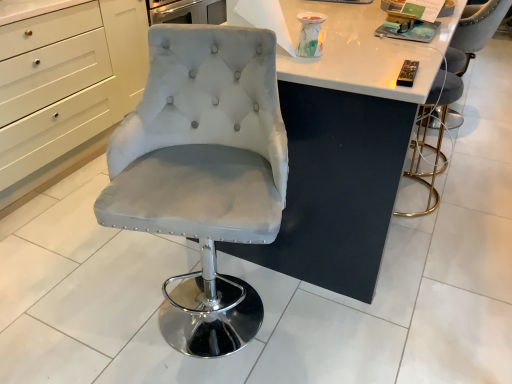
Identify the location of white matte cabinet at left. The height and width of the screenshot is (384, 512). (67, 89).

Describe the element at coordinates (409, 31) in the screenshot. I see `matte gray magazine at upper right, positioned as the 2th magazine in bottom-to-top order` at that location.

Find the location of a particular element. satin white chair at center, which is counted as the 1th chair, starting from the left is located at coordinates (203, 171).

What are the coordinates of `black plastic remote control at upper right, arranged as the second magazine when viewed from the top` in the screenshot? It's located at (407, 73).

At what (x,y) coordinates should I click in order to perform the action: click on metallic gold bar stool at right, the 2th chair from the front. Please return your answer as a coordinate pair (x, y). Looking at the image, I should click on (426, 135).

Is satin white chair at center, arranged as the 3th chair when viewed from the right, at the back of matte gray magazine at upper right, marked as the second magazine in a front-to-back arrangement?

No, matte gray magazine at upper right, marked as the second magazine in a front-to-back arrangement,'s orientation is not away from satin white chair at center, arranged as the 3th chair when viewed from the right.

Is matte gray magazine at upper right, positioned as the 2th magazine in bottom-to-top order, bigger than satin white chair at center, arranged as the 3th chair when viewed from the right?

Incorrect, matte gray magazine at upper right, positioned as the 2th magazine in bottom-to-top order, is not larger than satin white chair at center, arranged as the 3th chair when viewed from the right.

What's the angular difference between matte gray magazine at upper right, marked as the second magazine in a front-to-back arrangement, and satin white chair at center, arranged as the 3th chair when viewed from the right,'s facing directions?

The angular difference between matte gray magazine at upper right, marked as the second magazine in a front-to-back arrangement, and satin white chair at center, arranged as the 3th chair when viewed from the right, is 71.5 degrees.

From a real-world perspective, is matte gray magazine at upper right, which ranks as the 1th magazine in top-to-bottom order, physically below satin white chair at center, arranged as the first chair when viewed from the front?

No, from a real-world perspective, matte gray magazine at upper right, which ranks as the 1th magazine in top-to-bottom order, is not beneath satin white chair at center, arranged as the first chair when viewed from the front.

Which is in front, black plastic remote control at upper right, arranged as the second magazine when viewed from the top, or satin white chair at center, arranged as the first chair when viewed from the front?

satin white chair at center, arranged as the first chair when viewed from the front, is in front.

Measure the distance from black plastic remote control at upper right, positioned as the 1th magazine in front-to-back order, to satin white chair at center, arranged as the first chair when viewed from the front.

black plastic remote control at upper right, positioned as the 1th magazine in front-to-back order, is 24.71 inches away from satin white chair at center, arranged as the first chair when viewed from the front.

Is black plastic remote control at upper right, the first magazine positioned from the bottom, placed right next to satin white chair at center, which is counted as the 1th chair, starting from the left?

black plastic remote control at upper right, the first magazine positioned from the bottom, and satin white chair at center, which is counted as the 1th chair, starting from the left, are clearly separated.

Based on the photo, which object is thinner, black plastic remote control at upper right, arranged as the 2th magazine when viewed from the back, or satin white chair at center, arranged as the 3th chair when viewed from the right?

black plastic remote control at upper right, arranged as the 2th magazine when viewed from the back, is thinner.

This screenshot has height=384, width=512. Identify the location of the 1st magazine counting from the left of the velvet grey chair at right, the 3th chair when ordered from front to back. (409, 31).

Between velvet grey chair at right, the first chair viewed from the right, and matte gray magazine at upper right, marked as the second magazine in a front-to-back arrangement, which one has larger width?

With larger width is velvet grey chair at right, the first chair viewed from the right.

Considering the positions of point (477, 27) and point (431, 37), is point (477, 27) closer or farther from the camera than point (431, 37)?

Point (477, 27).

Based on their sizes in the image, would you say velvet grey chair at right, the first chair viewed from the right, is bigger or smaller than matte gray magazine at upper right, positioned as the 2th magazine in bottom-to-top order?

Considering their sizes, velvet grey chair at right, the first chair viewed from the right, takes up more space than matte gray magazine at upper right, positioned as the 2th magazine in bottom-to-top order.

Does matte gray magazine at upper right, marked as the second magazine in a front-to-back arrangement, have a greater height compared to velvet grey chair at right, the first chair viewed from the right?

No.

Based on the photo, what's the angular difference between matte gray magazine at upper right, marked as the second magazine in a front-to-back arrangement, and velvet grey chair at right, acting as the third chair starting from the left,'s facing directions?

The angle between the facing direction of matte gray magazine at upper right, marked as the second magazine in a front-to-back arrangement, and the facing direction of velvet grey chair at right, acting as the third chair starting from the left, is 179 degrees.

From a real-world perspective, is matte gray magazine at upper right, the first magazine viewed from the back, located higher than velvet grey chair at right, the 3th chair when ordered from front to back?

Yes, from a real-world perspective, matte gray magazine at upper right, the first magazine viewed from the back, is above velvet grey chair at right, the 3th chair when ordered from front to back.

Considering the relative sizes of matte gray magazine at upper right, which ranks as the 1th magazine in top-to-bottom order, and velvet grey chair at right, the 3th chair when ordered from front to back, in the image provided, is matte gray magazine at upper right, which ranks as the 1th magazine in top-to-bottom order, smaller than velvet grey chair at right, the 3th chair when ordered from front to back,?

Indeed, matte gray magazine at upper right, which ranks as the 1th magazine in top-to-bottom order, has a smaller size compared to velvet grey chair at right, the 3th chair when ordered from front to back.

Which is further, (401, 72) or (413, 29)?

Positioned behind is point (413, 29).

Can you confirm if black plastic remote control at upper right, arranged as the 2th magazine when viewed from the back, is taller than matte gray magazine at upper right, the first magazine viewed from the back?

Incorrect, the height of black plastic remote control at upper right, arranged as the 2th magazine when viewed from the back, is not larger of that of matte gray magazine at upper right, the first magazine viewed from the back.

Which object is more forward, black plastic remote control at upper right, positioned as the 1th magazine in front-to-back order, or matte gray magazine at upper right, marked as the second magazine in a front-to-back arrangement?

black plastic remote control at upper right, positioned as the 1th magazine in front-to-back order, is in front.

Considering the relative sizes of black plastic remote control at upper right, positioned as the 1th magazine in front-to-back order, and matte gray magazine at upper right, the first magazine viewed from the back, in the image provided, is black plastic remote control at upper right, positioned as the 1th magazine in front-to-back order, thinner than matte gray magazine at upper right, the first magazine viewed from the back,?

Correct, the width of black plastic remote control at upper right, positioned as the 1th magazine in front-to-back order, is less than that of matte gray magazine at upper right, the first magazine viewed from the back.

From a real-world perspective, is white matte cabinet at left positioned above or below black plastic remote control at upper right, the first magazine positioned from the bottom?

In terms of real-world spatial position, white matte cabinet at left is below black plastic remote control at upper right, the first magazine positioned from the bottom.

Is white matte cabinet at left positioned with its back to black plastic remote control at upper right, the first magazine positioned from the bottom?

No.

Is white matte cabinet at left to the left or to the right of black plastic remote control at upper right, arranged as the second magazine when viewed from the top, in the image?

Based on their positions, white matte cabinet at left is located to the left of black plastic remote control at upper right, arranged as the second magazine when viewed from the top.

Considering the sizes of velvet grey chair at right, the first chair viewed from the right, and metallic gold bar stool at right, the 2th chair viewed from the right, in the image, is velvet grey chair at right, the first chair viewed from the right, bigger or smaller than metallic gold bar stool at right, the 2th chair viewed from the right,?

Clearly, velvet grey chair at right, the first chair viewed from the right, is larger in size than metallic gold bar stool at right, the 2th chair viewed from the right.

Do you think velvet grey chair at right, which appears as the first chair when viewed from the back, is within metallic gold bar stool at right, the 2th chair from the front, or outside of it?

velvet grey chair at right, which appears as the first chair when viewed from the back, is outside metallic gold bar stool at right, the 2th chair from the front.

Can you confirm if velvet grey chair at right, acting as the third chair starting from the left, is thinner than metallic gold bar stool at right, the 2th chair from the front?

Yes.

In the image, is velvet grey chair at right, which appears as the first chair when viewed from the back, positioned in front of or behind metallic gold bar stool at right, the 2th chair from the front?

velvet grey chair at right, which appears as the first chair when viewed from the back, is positioned farther from the viewer than metallic gold bar stool at right, the 2th chair from the front.

Starting from the satin white chair at center, arranged as the first chair when viewed from the front, which magazine is the 2nd one to the right? Please provide its 2D coordinates.

[(409, 31)]

Where is `chair in front of the black plastic remote control at upper right, positioned as the 1th magazine in front-to-back order`? This screenshot has height=384, width=512. chair in front of the black plastic remote control at upper right, positioned as the 1th magazine in front-to-back order is located at coordinates (203, 171).

Based on their spatial positions, is metallic gold bar stool at right, arranged as the 2th chair when viewed from the left, or satin white chair at center, arranged as the 3th chair when viewed from the back, closer to velvet grey chair at right, the first chair viewed from the right?

Based on the image, metallic gold bar stool at right, arranged as the 2th chair when viewed from the left, appears to be nearer to velvet grey chair at right, the first chair viewed from the right.

From the image, which object appears to be farther from velvet grey chair at right, the 3th chair when ordered from front to back, white matte cabinet at left or matte gray magazine at upper right, the first magazine viewed from the back?

white matte cabinet at left lies further to velvet grey chair at right, the 3th chair when ordered from front to back, than the other object.

When comparing their distances from matte gray magazine at upper right, positioned as the 2th magazine in bottom-to-top order, does metallic gold bar stool at right, arranged as the 2th chair when viewed from the left, or white matte cabinet at left seem closer?

metallic gold bar stool at right, arranged as the 2th chair when viewed from the left, is positioned closer to the anchor matte gray magazine at upper right, positioned as the 2th magazine in bottom-to-top order.

Considering their positions, is white matte cabinet at left positioned further to metallic gold bar stool at right, the 2th chair from the front, than matte gray magazine at upper right, which ranks as the 1th magazine in top-to-bottom order?

Among the two, white matte cabinet at left is located further to metallic gold bar stool at right, the 2th chair from the front.

Which object lies further to the anchor point black plastic remote control at upper right, positioned as the 1th magazine in front-to-back order, white matte cabinet at left or satin white chair at center, which is counted as the 1th chair, starting from the left?

The object further to black plastic remote control at upper right, positioned as the 1th magazine in front-to-back order, is white matte cabinet at left.

Estimate the real-world distances between objects in this image. Which object is further from metallic gold bar stool at right, the 2th chair from the front, matte gray magazine at upper right, positioned as the 2th magazine in bottom-to-top order, or white matte cabinet at left?

white matte cabinet at left.

From the image, which object appears to be nearer to white matte cabinet at left, matte gray magazine at upper right, marked as the second magazine in a front-to-back arrangement, or velvet grey chair at right, the 3th chair when ordered from front to back?

Based on the image, matte gray magazine at upper right, marked as the second magazine in a front-to-back arrangement, appears to be nearer to white matte cabinet at left.

When comparing their distances from black plastic remote control at upper right, the first magazine positioned from the bottom, does metallic gold bar stool at right, positioned as the second chair in back-to-front order, or satin white chair at center, which is counted as the 1th chair, starting from the left, seem further?

Based on the image, metallic gold bar stool at right, positioned as the second chair in back-to-front order, appears to be further to black plastic remote control at upper right, the first magazine positioned from the bottom.

Image resolution: width=512 pixels, height=384 pixels. What are the coordinates of `magazine situated between satin white chair at center, arranged as the 3th chair when viewed from the back, and matte gray magazine at upper right, positioned as the 2th magazine in bottom-to-top order, from left to right` in the screenshot? It's located at (407, 73).

I want to click on chair between matte gray magazine at upper right, positioned as the 2th magazine in bottom-to-top order, and velvet grey chair at right, acting as the third chair starting from the left, in the front-back direction, so click(426, 135).

Where is `chair between white matte cabinet at left and matte gray magazine at upper right, marked as the second magazine in a front-to-back arrangement`? The height and width of the screenshot is (384, 512). chair between white matte cabinet at left and matte gray magazine at upper right, marked as the second magazine in a front-to-back arrangement is located at coordinates (203, 171).

The width and height of the screenshot is (512, 384). I want to click on magazine between black plastic remote control at upper right, arranged as the 2th magazine when viewed from the back, and velvet grey chair at right, which appears as the first chair when viewed from the back, along the z-axis, so click(409, 31).